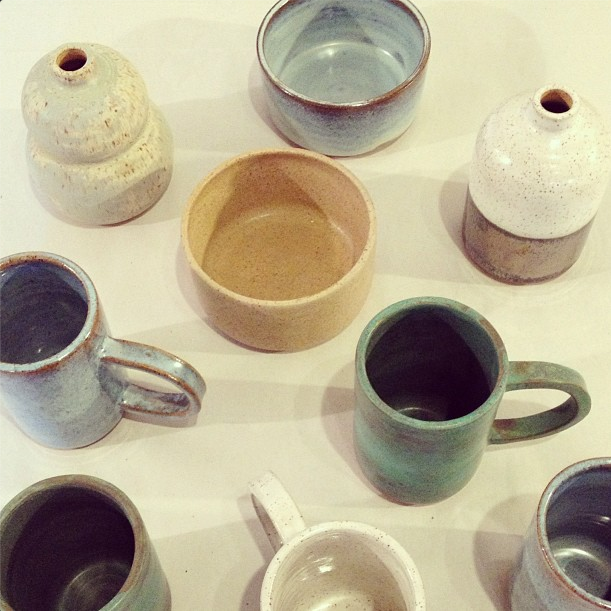
Provide coordinates for each where you place objects when you eat instance in the image. Your answer should be formatted as a list of tuples, i.e. [(x1, y1), (x2, y2), ...], where each tuple contains the x and y coordinates of a point satisfying the conditions above.

[(137, 288)]